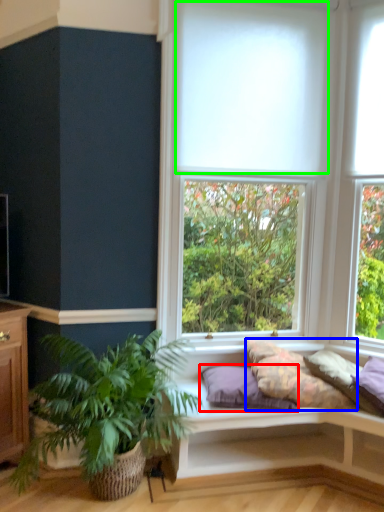
Question: Which is farther away from pillow (highlighted by a red box)? pillow (highlighted by a blue box) or blind (highlighted by a green box)?

Choices:
 (A) pillow
 (B) blind

Answer: (B)